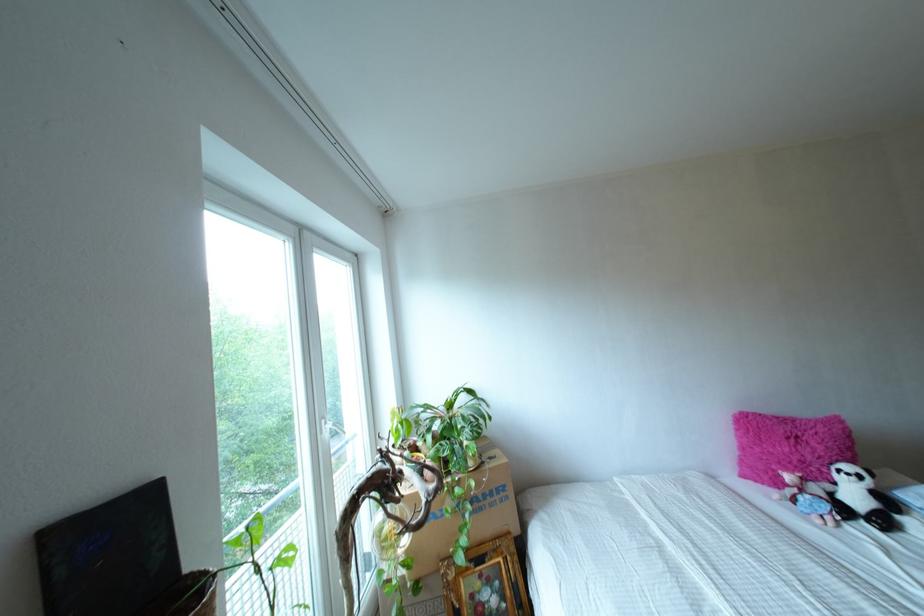
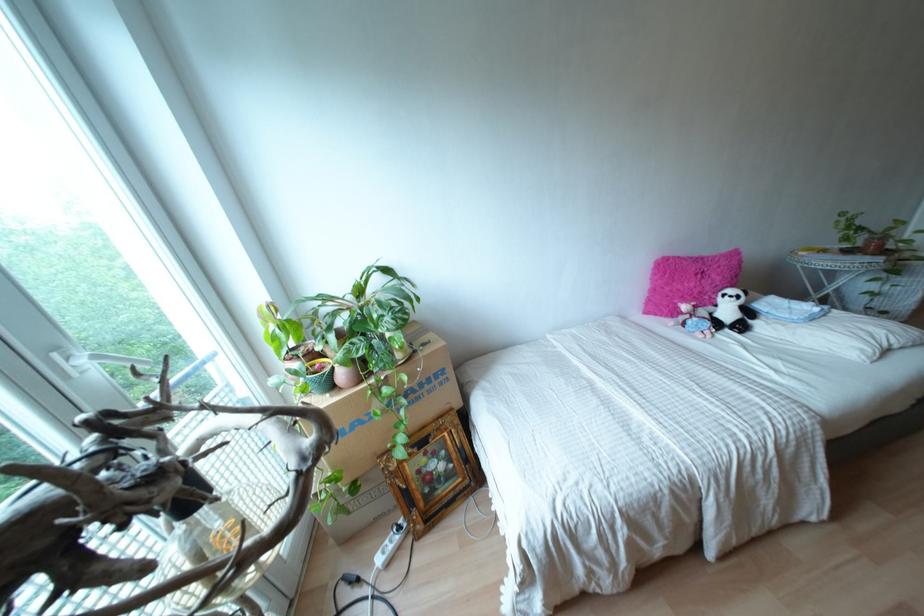
Where in the second image is the point corresponding to point (757, 448) from the first image?

(666, 288)